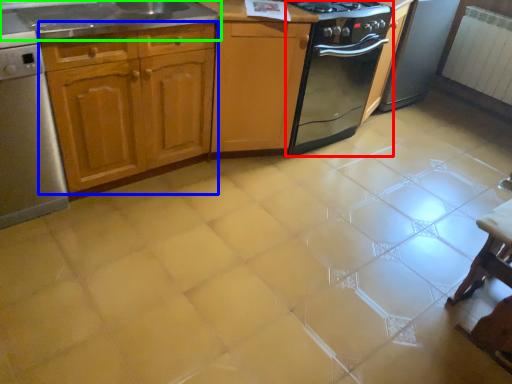
Question: Which object is the farthest from kitchen appliance (highlighted by a red box)? Choose among these: cabinetry (highlighted by a blue box) or countertop (highlighted by a green box).

Choices:
 (A) cabinetry
 (B) countertop

Answer: (B)